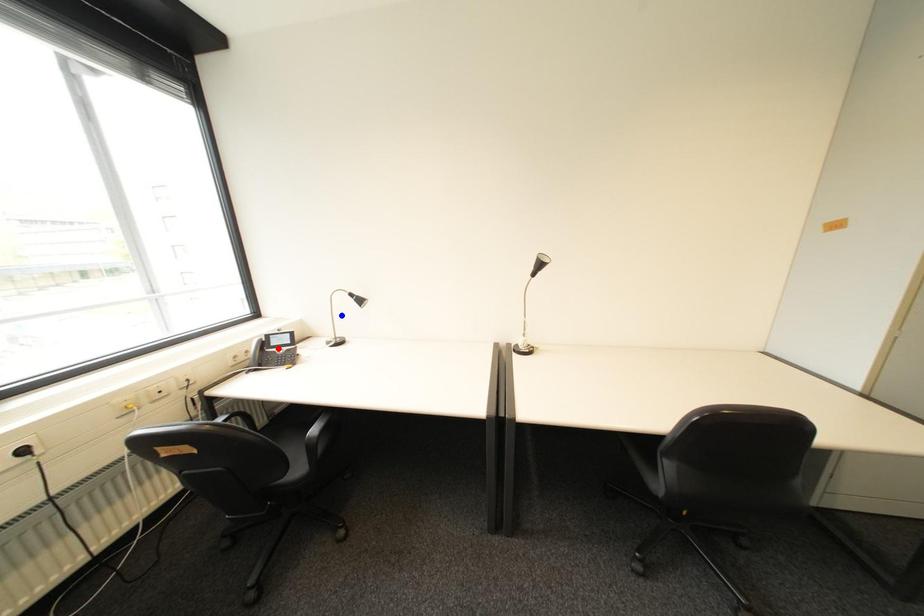
Question: Which of the two points in the image is closer to the camera?

Choices:
 (A) Blue point is closer.
 (B) Red point is closer.

Answer: (B)